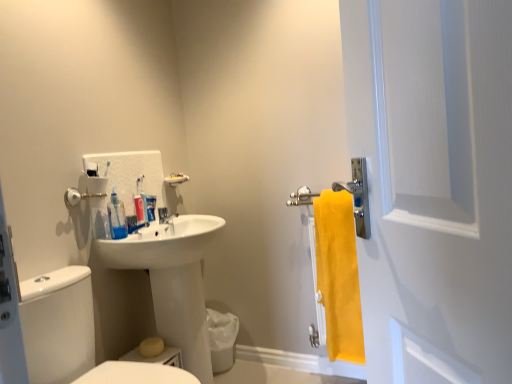
You are a GUI agent. You are given a task and a screenshot of the screen. Output one action in this format:
    pyautogui.click(x=<x>, y=<y>)
    Task: Click on the empty space that is to the right of translucent plastic toothpaste tube at upper center
    This screenshot has width=512, height=384.
    Given the screenshot: What is the action you would take?
    pyautogui.click(x=189, y=228)